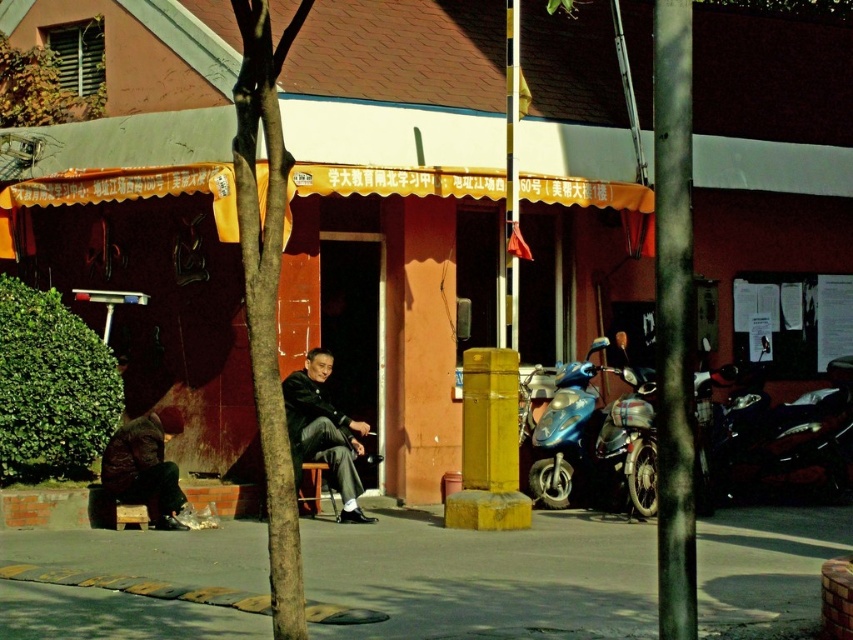
You are a delivery person standing at the point marked as point (247, 68). You need to deliver a package to a location 6.39 meters away from your current position. Is there enough space to move straight to the destination without any obstacles?

The two points are 6.39 meters apart, and the path between them is clear of obstacles as described in the scene. Yes, you can move straight to the destination.

You are standing at point (165,440) and want to walk to the other side of the street. The street has a curb with yellow tactile paving strips. What is the minimum distance you need to walk to reach the curb?

The minimum distance you need to walk to reach the curb is 11.63 meters.